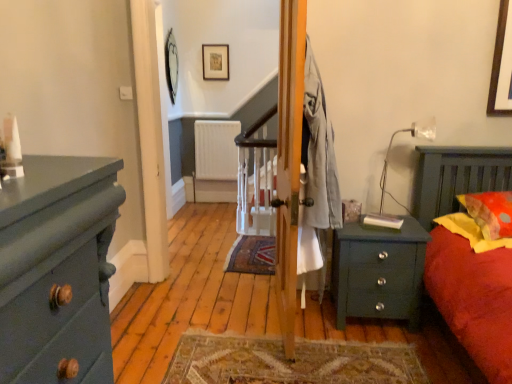
Where is `yellow fabric pillow at right, which is counted as the second pillow, starting from the top`? yellow fabric pillow at right, which is counted as the second pillow, starting from the top is located at coordinates (471, 232).

This screenshot has height=384, width=512. What do you see at coordinates (490, 212) in the screenshot?
I see `orange dotted fabric pillow at right, which ranks as the 2th pillow in bottom-to-top order` at bounding box center [490, 212].

You are a GUI agent. You are given a task and a screenshot of the screen. Output one action in this format:
    pyautogui.click(x=<x>, y=<y>)
    Task: Click on the matte dark green dresser at left
    This screenshot has height=384, width=512.
    Given the screenshot: What is the action you would take?
    pyautogui.click(x=57, y=270)

Where is `green matte nightstand at lower right`? green matte nightstand at lower right is located at coordinates (378, 271).

What do you see at coordinates (378, 271) in the screenshot?
I see `green matte nightstand at lower right` at bounding box center [378, 271].

How much space does metallic mirror at upper center, the 1th picture frame when ordered from left to right, occupy vertically?

metallic mirror at upper center, the 1th picture frame when ordered from left to right, is 81.67 centimeters in height.

This screenshot has height=384, width=512. What do you see at coordinates (216, 150) in the screenshot? I see `white matte radiator at center` at bounding box center [216, 150].

The image size is (512, 384). Describe the element at coordinates (215, 61) in the screenshot. I see `wooden picture frame at upper center, positioned as the 1th picture frame in right-to-left order` at that location.

How much space does wooden picture frame at upper center, positioned as the 1th picture frame in right-to-left order, occupy horizontally?

It is 1.29 inches.

Find the location of `yellow fabric pillow at right, which appears as the 1th pillow when ordered from the bottom`. yellow fabric pillow at right, which appears as the 1th pillow when ordered from the bottom is located at coordinates (471, 232).

Where is `the 2nd picture frame to the left of the metallic silver lamp at right, starting your count from the anchor`? The image size is (512, 384). the 2nd picture frame to the left of the metallic silver lamp at right, starting your count from the anchor is located at coordinates (170, 65).

From the image's perspective, is metallic silver lamp at right over metallic mirror at upper center, the 1th picture frame when ordered from left to right?

Incorrect, from the image's perspective, metallic silver lamp at right is lower than metallic mirror at upper center, the 1th picture frame when ordered from left to right.

Who is shorter, metallic silver lamp at right or metallic mirror at upper center, which is the second picture frame from right to left?

With less height is metallic silver lamp at right.

Considering their positions, is metallic silver lamp at right located in front of or behind metallic mirror at upper center, the 1th picture frame when ordered from left to right?

metallic silver lamp at right is positioned closer to the viewer than metallic mirror at upper center, the 1th picture frame when ordered from left to right.

Looking at this image, is green matte nightstand at lower right to the left of yellow fabric pillow at right, which is counted as the second pillow, starting from the top, from the viewer's perspective?

Correct, you'll find green matte nightstand at lower right to the left of yellow fabric pillow at right, which is counted as the second pillow, starting from the top.

Is green matte nightstand at lower right not close to yellow fabric pillow at right, which is counted as the second pillow, starting from the top?

No, green matte nightstand at lower right is in close proximity to yellow fabric pillow at right, which is counted as the second pillow, starting from the top.

Considering the sizes of green matte nightstand at lower right and yellow fabric pillow at right, which is counted as the second pillow, starting from the top, in the image, is green matte nightstand at lower right taller or shorter than yellow fabric pillow at right, which is counted as the second pillow, starting from the top,?

Considering their sizes, green matte nightstand at lower right has more height than yellow fabric pillow at right, which is counted as the second pillow, starting from the top.

From a real-world perspective, which object rests below the other?

In real-world perspective, green matte nightstand at lower right is lower.

Is the position of white matte radiator at center less distant than that of metallic silver lamp at right?

No, it is not.

Would you consider white matte radiator at center to be distant from metallic silver lamp at right?

Absolutely, white matte radiator at center is distant from metallic silver lamp at right.

Between white matte radiator at center and metallic silver lamp at right, which one has larger width?

metallic silver lamp at right is wider.

Does white matte radiator at center have a greater height compared to metallic silver lamp at right?

Yes, white matte radiator at center is taller than metallic silver lamp at right.

Is orange dotted fabric pillow at right, the first pillow when ordered from top to bottom, facing away from yellow fabric pillow at right, which appears as the 1th pillow when ordered from the bottom?

No.

Would you say orange dotted fabric pillow at right, the first pillow when ordered from top to bottom, is a long distance from yellow fabric pillow at right, which is counted as the second pillow, starting from the top?

No, orange dotted fabric pillow at right, the first pillow when ordered from top to bottom, is not far from yellow fabric pillow at right, which is counted as the second pillow, starting from the top.

Is matte dark green dresser at left facing away from wooden picture frame at upper center, positioned as the 1th picture frame in right-to-left order?

No, wooden picture frame at upper center, positioned as the 1th picture frame in right-to-left order, is not at the back of matte dark green dresser at left.

From a real-world perspective, is matte dark green dresser at left above or below wooden picture frame at upper center, placed as the second picture frame when sorted from left to right?

From a real-world perspective, matte dark green dresser at left is physically below wooden picture frame at upper center, placed as the second picture frame when sorted from left to right.

How far apart are matte dark green dresser at left and wooden picture frame at upper center, placed as the second picture frame when sorted from left to right?

matte dark green dresser at left is 3.99 meters away from wooden picture frame at upper center, placed as the second picture frame when sorted from left to right.

From the image's perspective, does matte dark green dresser at left appear lower than wooden picture frame at upper center, placed as the second picture frame when sorted from left to right?

Indeed, from the image's perspective, matte dark green dresser at left is shown beneath wooden picture frame at upper center, placed as the second picture frame when sorted from left to right.

Is wooden picture frame at upper center, positioned as the 1th picture frame in right-to-left order, oriented away from green matte nightstand at lower right?

wooden picture frame at upper center, positioned as the 1th picture frame in right-to-left order, is not turned away from green matte nightstand at lower right.

From the image's perspective, which one is positioned higher, wooden picture frame at upper center, positioned as the 1th picture frame in right-to-left order, or green matte nightstand at lower right?

wooden picture frame at upper center, positioned as the 1th picture frame in right-to-left order.

From a real-world perspective, is wooden picture frame at upper center, positioned as the 1th picture frame in right-to-left order, beneath green matte nightstand at lower right?

No, from a real-world perspective, wooden picture frame at upper center, positioned as the 1th picture frame in right-to-left order, is not under green matte nightstand at lower right.

Can we say wooden picture frame at upper center, positioned as the 1th picture frame in right-to-left order, lies outside green matte nightstand at lower right?

Yes, wooden picture frame at upper center, positioned as the 1th picture frame in right-to-left order, is located beyond the bounds of green matte nightstand at lower right.

Does point (213, 169) appear closer or farther from the camera than point (170, 98)?

Point (213, 169) is farther from the camera than point (170, 98).

Considering the sizes of objects white matte radiator at center and metallic mirror at upper center, which is the second picture frame from right to left, in the image provided, who is taller, white matte radiator at center or metallic mirror at upper center, which is the second picture frame from right to left,?

metallic mirror at upper center, which is the second picture frame from right to left.

Is white matte radiator at center positioned with its back to metallic mirror at upper center, which is the second picture frame from right to left?

No, white matte radiator at center is not facing away from metallic mirror at upper center, which is the second picture frame from right to left.

The height and width of the screenshot is (384, 512). There is a white matte radiator at center. Identify the location of the 1st picture frame above it (from a real-world perspective). (170, 65).

At what (x,y) coordinates should I click in order to perform the action: click on the 2nd picture frame counting from the left side of the metallic silver lamp at right. Please return your answer as a coordinate pair (x, y). Looking at the image, I should click on (170, 65).

At what (x,y) coordinates should I click in order to perform the action: click on nightstand behind the yellow fabric pillow at right, which is counted as the second pillow, starting from the top. Please return your answer as a coordinate pair (x, y). The height and width of the screenshot is (384, 512). Looking at the image, I should click on (378, 271).

Based on the photo, based on their spatial positions, is yellow fabric pillow at right, which appears as the 1th pillow when ordered from the bottom, or white matte radiator at center closer to wooden picture frame at upper center, positioned as the 1th picture frame in right-to-left order?

white matte radiator at center is closer to wooden picture frame at upper center, positioned as the 1th picture frame in right-to-left order.

Looking at the image, which one is located further to yellow fabric pillow at right, which is counted as the second pillow, starting from the top, matte dark green dresser at left or green matte nightstand at lower right?

matte dark green dresser at left is positioned further to the anchor yellow fabric pillow at right, which is counted as the second pillow, starting from the top.

Considering their positions, is white matte radiator at center positioned further to metallic mirror at upper center, which is the second picture frame from right to left, than orange dotted fabric pillow at right, the first pillow when ordered from top to bottom?

orange dotted fabric pillow at right, the first pillow when ordered from top to bottom, lies further to metallic mirror at upper center, which is the second picture frame from right to left, than the other object.

Based on the photo, which object lies nearer to the anchor point white matte radiator at center, matte dark green dresser at left or wooden picture frame at upper center, positioned as the 1th picture frame in right-to-left order?

Based on the image, wooden picture frame at upper center, positioned as the 1th picture frame in right-to-left order, appears to be nearer to white matte radiator at center.

Estimate the real-world distances between objects in this image. Which object is closer to metallic silver lamp at right, white matte radiator at center or orange dotted fabric pillow at right, the first pillow when ordered from top to bottom?

orange dotted fabric pillow at right, the first pillow when ordered from top to bottom, is positioned closer to the anchor metallic silver lamp at right.

Which object lies nearer to the anchor point orange dotted fabric pillow at right, the first pillow when ordered from top to bottom, metallic silver lamp at right or matte dark green dresser at left?

Based on the image, metallic silver lamp at right appears to be nearer to orange dotted fabric pillow at right, the first pillow when ordered from top to bottom.

Based on their spatial positions, is white matte radiator at center or metallic silver lamp at right further from orange dotted fabric pillow at right, which ranks as the 2th pillow in bottom-to-top order?

The object further to orange dotted fabric pillow at right, which ranks as the 2th pillow in bottom-to-top order, is white matte radiator at center.

Based on their spatial positions, is yellow fabric pillow at right, which is counted as the second pillow, starting from the top, or white matte radiator at center further from metallic mirror at upper center, the 1th picture frame when ordered from left to right?

yellow fabric pillow at right, which is counted as the second pillow, starting from the top, lies further to metallic mirror at upper center, the 1th picture frame when ordered from left to right, than the other object.

Where is `nightstand between matte dark green dresser at left and white matte radiator at center from front to back`? The width and height of the screenshot is (512, 384). nightstand between matte dark green dresser at left and white matte radiator at center from front to back is located at coordinates (378, 271).

The width and height of the screenshot is (512, 384). In order to click on picture frame located between yellow fabric pillow at right, which is counted as the second pillow, starting from the top, and wooden picture frame at upper center, placed as the second picture frame when sorted from left to right, in the depth direction in this screenshot , I will do `click(170, 65)`.

The image size is (512, 384). What are the coordinates of `pillow between green matte nightstand at lower right and orange dotted fabric pillow at right, the first pillow when ordered from top to bottom` in the screenshot? It's located at (471, 232).

This screenshot has height=384, width=512. Find the location of `lamp between green matte nightstand at lower right and metallic mirror at upper center, the 1th picture frame when ordered from left to right, in the front-back direction`. lamp between green matte nightstand at lower right and metallic mirror at upper center, the 1th picture frame when ordered from left to right, in the front-back direction is located at coordinates (391, 146).